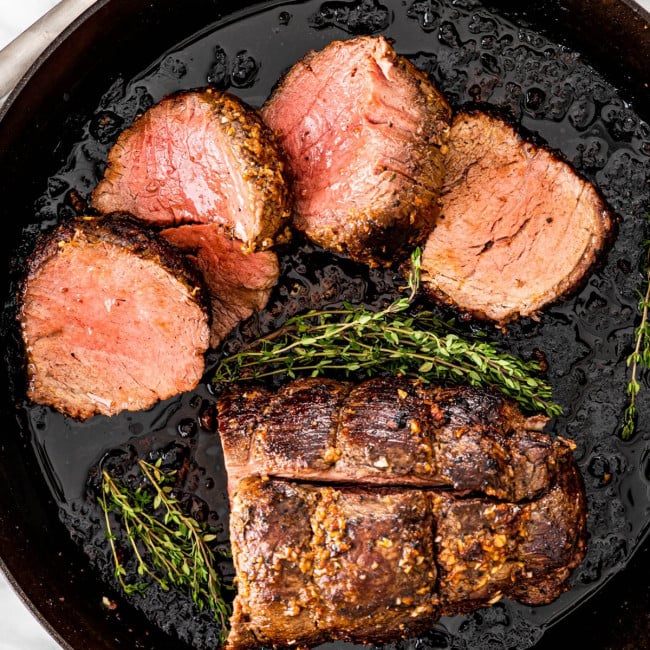
Find the location of `rim of the cast iron pan`. rim of the cast iron pan is located at coordinates (20, 590), (58, 637), (20, 80), (72, 29), (638, 10).